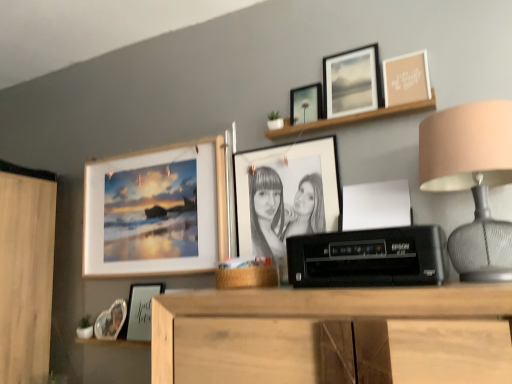
Question: From the image's perspective, is wooden frame at upper center, placed as the second shelf when sorted from bottom to top, above or below black plastic printer at center?

Choices:
 (A) below
 (B) above

Answer: (B)

Question: Is wooden frame at upper center, positioned as the 2th shelf in back-to-front order, inside or outside of black plastic printer at center?

Choices:
 (A) inside
 (B) outside

Answer: (B)

Question: Which object is the closest to the beige fabric lampshade at right?

Choices:
 (A) matte black picture frame at upper center, which appears as the third picture frame when viewed from the right
 (B) wooden picture frame at upper right, which ranks as the first picture frame in right-to-left order
 (C) matte black picture frame at upper center, the 2th picture frame in the right-to-left sequence
 (D) matte black picture frame at lower left, which is counted as the 5th picture frame, starting from the right
 (E) white matte frame at lower center, positioned as the second shelf in top-to-bottom order

Answer: (B)

Question: Which object is positioned closest to the wooden frame at upper center, the first shelf when ordered from front to back?

Choices:
 (A) matte black photo frame at center, which is counted as the fourth picture frame, starting from the right
 (B) matte black picture frame at upper center, the 2th picture frame in the right-to-left sequence
 (C) matte wooden picture frame at upper left, the sixth picture frame viewed from the right
 (D) white matte frame at lower center, positioned as the second shelf in top-to-bottom order
 (E) beige fabric lampshade at right

Answer: (B)